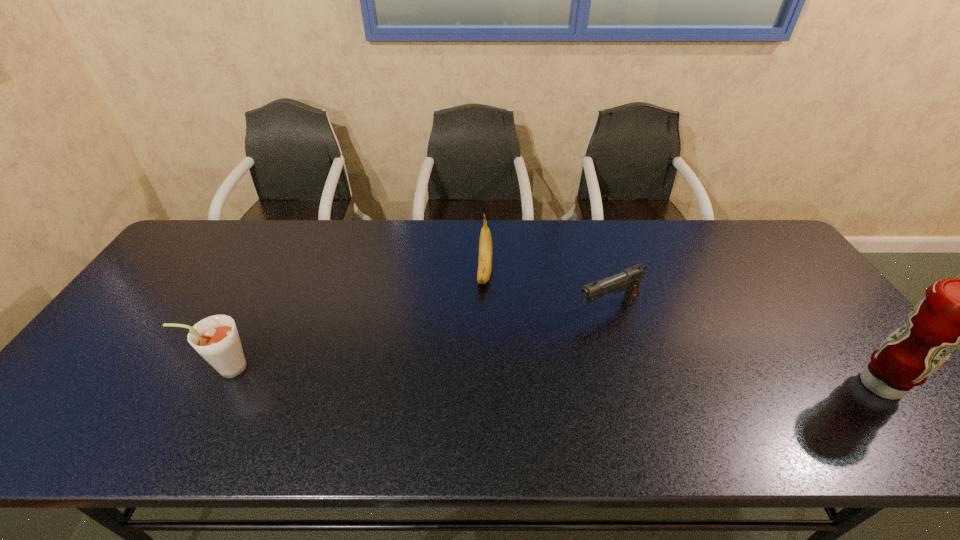
Where is `unoccupied area between the second farthest object and the leftmost object`? unoccupied area between the second farthest object and the leftmost object is located at coordinates pos(418,338).

Where is `free space between the root beer and the condiment`? free space between the root beer and the condiment is located at coordinates (x=554, y=376).

Find the location of a particular element. Image resolution: width=960 pixels, height=540 pixels. free space that is in between the leftmost object and the banana is located at coordinates (356, 320).

Locate an element on the screen. The height and width of the screenshot is (540, 960). empty location between the gun and the banana is located at coordinates (546, 291).

Locate an element on the screen. vacant area that lies between the leftmost object and the tallest object is located at coordinates pyautogui.click(x=554, y=376).

In order to click on free space between the rightmost object and the farthest object in this screenshot , I will do `click(683, 329)`.

Point out which object is positioned as the nearest to the farthest object. Please provide its 2D coordinates. Your answer should be formatted as a tuple, i.e. [(x, y)], where the tuple contains the x and y coordinates of a point satisfying the conditions above.

[(629, 279)]

Choose which object is the nearest neighbor to the root beer. Please provide its 2D coordinates. Your answer should be formatted as a tuple, i.e. [(x, y)], where the tuple contains the x and y coordinates of a point satisfying the conditions above.

[(485, 242)]